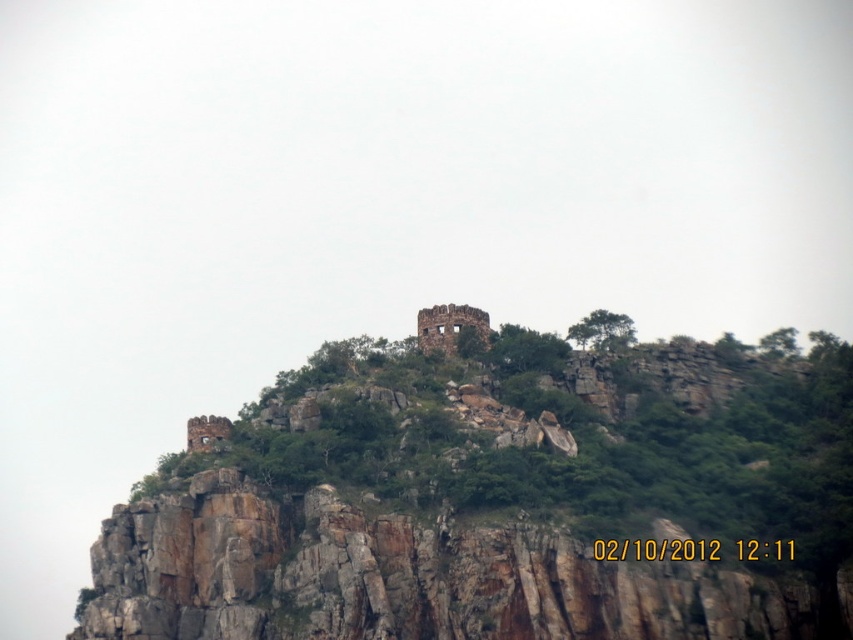
Question: Does rusty stone ruins at upper center appear on the right side of rustic stone castle at upper center?

Choices:
 (A) yes
 (B) no

Answer: (A)

Question: Does rusty stone ruins at upper center have a larger size compared to rustic stone castle at upper center?

Choices:
 (A) yes
 (B) no

Answer: (A)

Question: Which of the following is the closest to the observer?

Choices:
 (A) (480, 342)
 (B) (795, 417)

Answer: (B)

Question: Is rusty stone ruins at upper center to the right of rustic stone castle at upper center from the viewer's perspective?

Choices:
 (A) yes
 (B) no

Answer: (A)